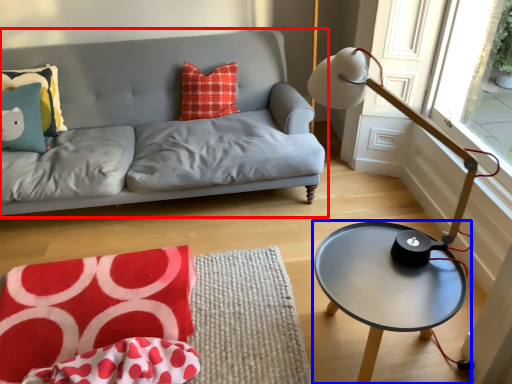
Question: Which point is further to the camera, studio couch (highlighted by a red box) or coffee table (highlighted by a blue box)?

Choices:
 (A) studio couch
 (B) coffee table

Answer: (A)